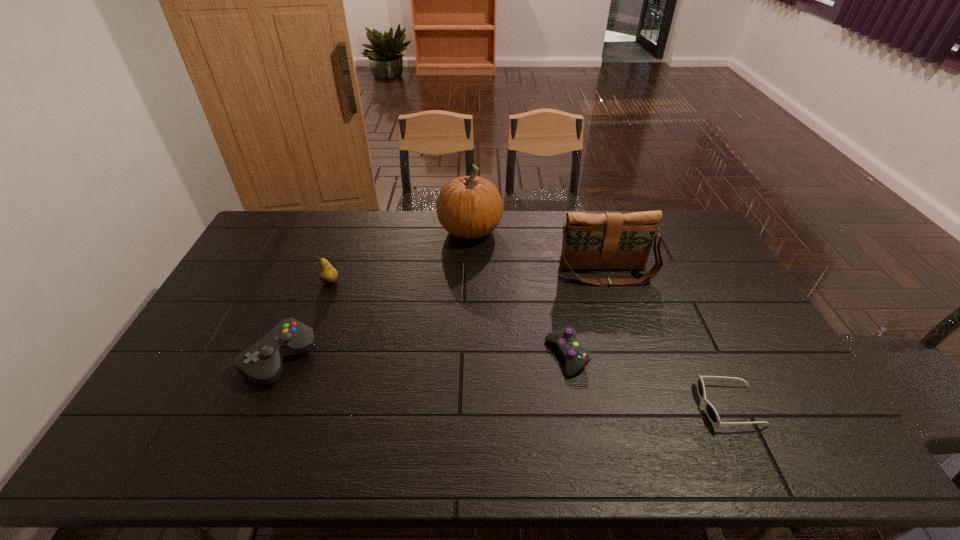
Where is `blank region between the shorter control and the shoulder bag`? blank region between the shorter control and the shoulder bag is located at coordinates (587, 315).

At what (x,y) coordinates should I click in order to perform the action: click on empty location between the pear and the right control. Please return your answer as a coordinate pair (x, y). Looking at the image, I should click on (449, 319).

Locate an element on the screen. The image size is (960, 540). vacant space in between the left control and the sunglasses is located at coordinates [x=505, y=382].

In order to click on vacant area that lies between the shoulder bag and the shortest object in this screenshot , I will do `click(668, 339)`.

Image resolution: width=960 pixels, height=540 pixels. In order to click on vacant space in between the fifth shortest object and the third shortest object in this screenshot , I will do `click(444, 315)`.

Identify the location of vacant space that is in between the sunglasses and the pumpkin. [600, 318].

Locate which object is the fourth closest to the pear. Please provide its 2D coordinates. Your answer should be formatted as a tuple, i.e. [(x, y)], where the tuple contains the x and y coordinates of a point satisfying the conditions above.

[(610, 240)]

Locate which object is the closest to the shortest object. Please provide its 2D coordinates. Your answer should be formatted as a tuple, i.e. [(x, y)], where the tuple contains the x and y coordinates of a point satisfying the conditions above.

[(576, 357)]

Identify the location of vacant position in the image that satisfies the following two spatial constraints: 1. on the stem of the fourth object from right to left; 2. on the front side of the fourth shortest object. The height and width of the screenshot is (540, 960). (468, 282).